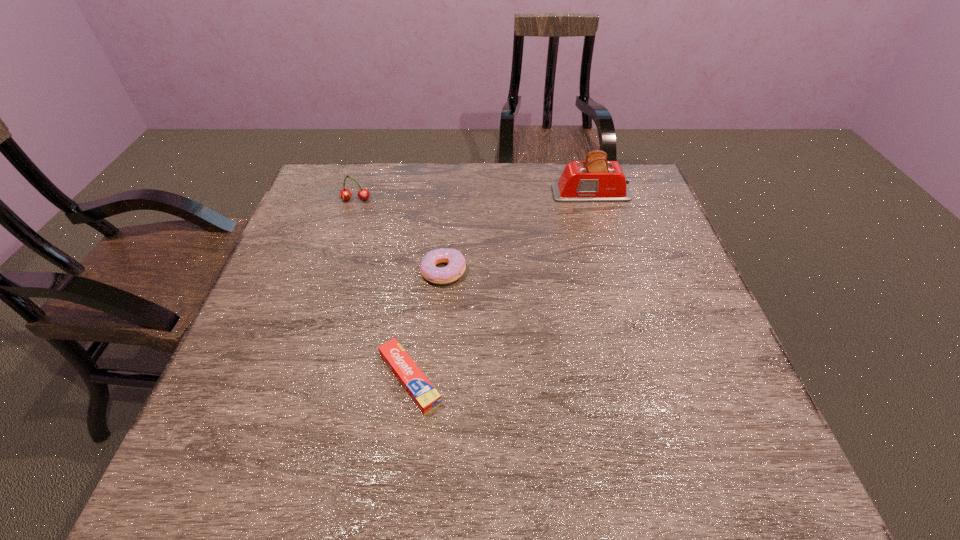
The width and height of the screenshot is (960, 540). I want to click on free point between the second shortest object and the leftmost object, so click(x=399, y=235).

Find the location of a particular element. Image resolution: width=960 pixels, height=540 pixels. free space between the cherry and the toaster is located at coordinates (473, 197).

Choose which object is the second nearest neighbor to the second shortest object. Please provide its 2D coordinates. Your answer should be formatted as a tuple, i.e. [(x, y)], where the tuple contains the x and y coordinates of a point satisfying the conditions above.

[(345, 194)]

Locate an element on the screen. This screenshot has height=540, width=960. the third closest object to the nearest object is located at coordinates (595, 180).

At what (x,y) coordinates should I click in order to perform the action: click on free space in the image that satisfies the following two spatial constraints: 1. with stems pointing upwards on the leftmost object; 2. on the left side of the third tallest object. Please return your answer as a coordinate pair (x, y). The height and width of the screenshot is (540, 960). Looking at the image, I should click on (332, 271).

The width and height of the screenshot is (960, 540). Find the location of `free space that satisfies the following two spatial constraints: 1. with stems pointing upwards on the nearest object; 2. on the right side of the second tallest object`. free space that satisfies the following two spatial constraints: 1. with stems pointing upwards on the nearest object; 2. on the right side of the second tallest object is located at coordinates (298, 379).

The height and width of the screenshot is (540, 960). Find the location of `free location that satisfies the following two spatial constraints: 1. with stems pointing upwards on the doughnut; 2. on the right side of the cherry`. free location that satisfies the following two spatial constraints: 1. with stems pointing upwards on the doughnut; 2. on the right side of the cherry is located at coordinates (332, 271).

Locate an element on the screen. blank space that satisfies the following two spatial constraints: 1. with stems pointing upwards on the toothpaste; 2. on the right side of the third shortest object is located at coordinates (298, 379).

Locate an element on the screen. The image size is (960, 540). free point that satisfies the following two spatial constraints: 1. with stems pointing upwards on the second tallest object; 2. on the left side of the toothpaste is located at coordinates (298, 379).

Where is `vacant space that satisfies the following two spatial constraints: 1. on the back side of the doughnut; 2. on the left side of the nearest object`? vacant space that satisfies the following two spatial constraints: 1. on the back side of the doughnut; 2. on the left side of the nearest object is located at coordinates (423, 271).